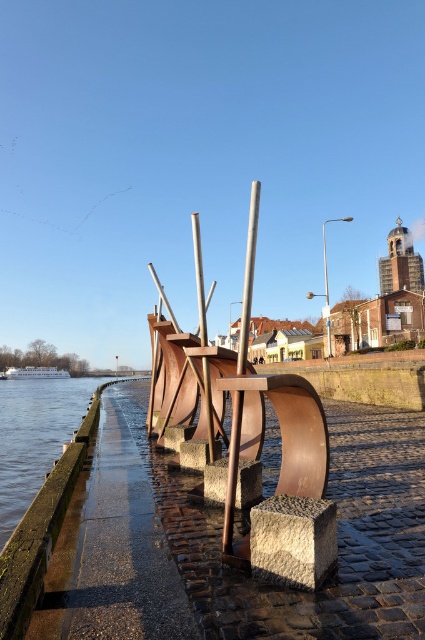
Question: Which point is farther to the camera?

Choices:
 (A) (229, 500)
 (B) (200, 330)
 (C) (280, 492)

Answer: (B)

Question: Which of the following is the closest to the observer?

Choices:
 (A) (249, 220)
 (B) (306, 410)

Answer: (B)

Question: Which point appears closest to the camera in this image?

Choices:
 (A) (232, 488)
 (B) (252, 236)
 (C) (200, 304)

Answer: (A)

Question: Observing the image, what is the correct spatial positioning of smooth wood pole at center in reference to polished metal pole at center?

Choices:
 (A) right
 (B) left

Answer: (A)

Question: From the image, what is the correct spatial relationship of rusty metal sculpture at center in relation to polished metal pole at center?

Choices:
 (A) left
 (B) right

Answer: (B)

Question: Is smooth wood pole at center smaller than polished metal pole at center?

Choices:
 (A) no
 (B) yes

Answer: (A)